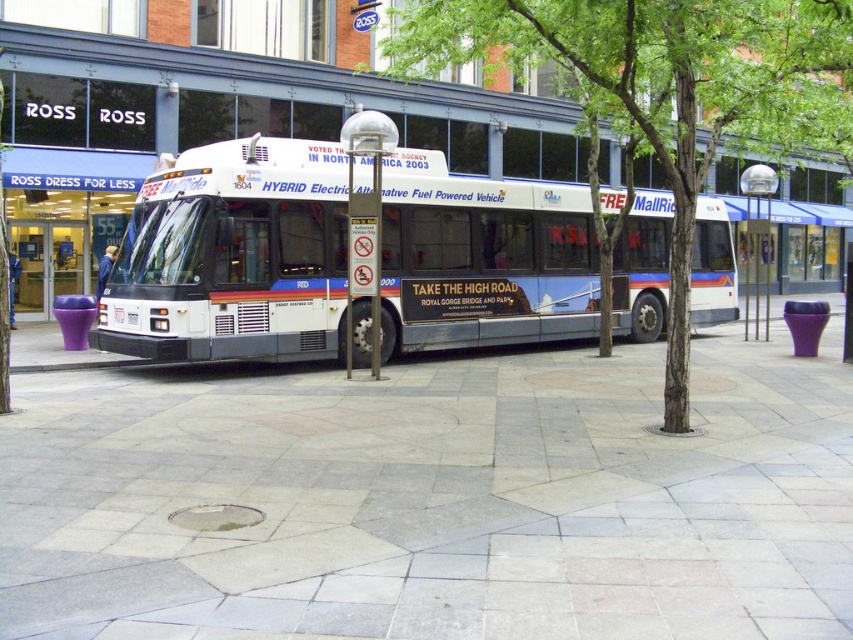
Is point (325, 312) positioned behind point (676, 250)?

Yes, point (325, 312) is behind point (676, 250).

Does white matte bus at center have a larger size compared to green leafy tree at center?

Incorrect, white matte bus at center is not larger than green leafy tree at center.

Measure the distance between point (425,170) and camera.

15.77 meters

Find the location of a particular element. white matte bus at center is located at coordinates (234, 257).

Between point (22, 576) and point (689, 186), which one is positioned behind?

Point (689, 186)

Who is more forward, (833, 344) or (606, 6)?

Point (606, 6) is in front.

The height and width of the screenshot is (640, 853). I want to click on gray stone pavement at center, so point(434,499).

Between point (659, 513) and point (521, 298), which one is positioned in front?

Positioned in front is point (659, 513).

Can you confirm if gray stone pavement at center is smaller than white matte bus at center?

Indeed, gray stone pavement at center has a smaller size compared to white matte bus at center.

Identify the location of gray stone pavement at center. 434,499.

The width and height of the screenshot is (853, 640). In order to click on gray stone pavement at center in this screenshot , I will do 434,499.